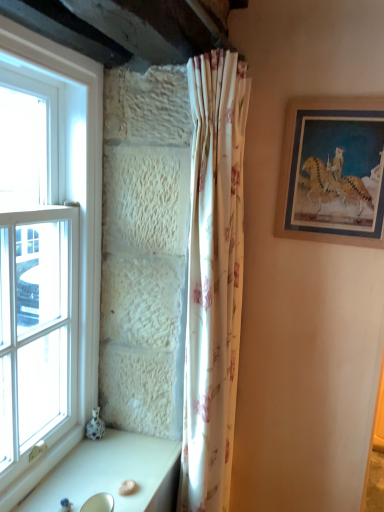
The width and height of the screenshot is (384, 512). What do you see at coordinates (69, 203) in the screenshot?
I see `white glass window at left` at bounding box center [69, 203].

Find the location of a particular element. The height and width of the screenshot is (512, 384). white glossy table at lower left is located at coordinates (112, 474).

Is white floral fabric curtain at center behind white glossy table at lower left?

Yes, it is.

Considering the positions of point (213, 351) and point (180, 447), is point (213, 351) closer or farther from the camera than point (180, 447)?

Point (213, 351) is positioned closer to the camera compared to point (180, 447).

Would you say white floral fabric curtain at center is outside white glossy table at lower left?

Yes.

Can you tell me how much white floral fabric curtain at center and white glossy table at lower left differ in facing direction?

0.000691 degrees.

Can you confirm if white glossy table at lower left is taller than white glossy sink at lower left?

No.

Identify the location of table located on the left of white glossy sink at lower left. This screenshot has width=384, height=512. (112, 474).

Is the position of white glossy table at lower left less distant than that of white glossy sink at lower left?

No, white glossy table at lower left is further to the viewer.

Does white glossy table at lower left have a smaller size compared to white glossy sink at lower left?

No.

Is white glass window at left aimed at wooden picture frame at upper right?

No.

This screenshot has width=384, height=512. I want to click on window below the wooden picture frame at upper right (from the image's perspective), so click(69, 203).

Based on the photo, is white glass window at left inside or outside of wooden picture frame at upper right?

white glass window at left is not enclosed by wooden picture frame at upper right.

Can you confirm if white glossy table at lower left is shorter than white floral fabric curtain at center?

Yes.

The width and height of the screenshot is (384, 512). Find the location of `curtain above the white glossy table at lower left (from the image's perspective)`. curtain above the white glossy table at lower left (from the image's perspective) is located at coordinates (213, 278).

Can you confirm if white glossy table at lower left is positioned to the right of white floral fabric curtain at center?

In fact, white glossy table at lower left is to the left of white floral fabric curtain at center.

Is white floral fabric curtain at center spatially inside white glossy sink at lower left, or outside of it?

The correct answer is: outside.

Is white floral fabric curtain at center facing towards white glossy sink at lower left?

No, white floral fabric curtain at center is not turned towards white glossy sink at lower left.

Between white floral fabric curtain at center and white glossy sink at lower left, which one has less height?

With less height is white glossy sink at lower left.

Which object is wider, white floral fabric curtain at center or white glossy sink at lower left?

Wider between the two is white floral fabric curtain at center.

Considering the positions of objects white glass window at left and white floral fabric curtain at center in the image provided, who is in front, white glass window at left or white floral fabric curtain at center?

Positioned in front is white glass window at left.

From the image's perspective, is white glass window at left below white floral fabric curtain at center?

No, from the image's perspective, white glass window at left is not below white floral fabric curtain at center.

Can you confirm if white glass window at left is positioned to the right of white floral fabric curtain at center?

No, white glass window at left is not to the right of white floral fabric curtain at center.

Locate an element on the screen. window above the white floral fabric curtain at center (from a real-world perspective) is located at coordinates (69, 203).

Considering the positions of objects wooden picture frame at upper right and white glossy table at lower left in the image provided, who is more to the left, wooden picture frame at upper right or white glossy table at lower left?

white glossy table at lower left.

Does point (311, 168) come in front of point (139, 484)?

No.

Is wooden picture frame at upper right turned away from white glossy table at lower left?

wooden picture frame at upper right does not have its back to white glossy table at lower left.

From a real-world perspective, is wooden picture frame at upper right located beneath white glossy table at lower left?

No, from a real-world perspective, wooden picture frame at upper right is not below white glossy table at lower left.

Where is `curtain on the right of white glossy table at lower left`? curtain on the right of white glossy table at lower left is located at coordinates (213, 278).

Find the location of a particular element. This screenshot has width=384, height=512. table on the left of the white glossy sink at lower left is located at coordinates 112,474.

Based on their spatial positions, is white glossy table at lower left or white floral fabric curtain at center further from white glossy sink at lower left?

white floral fabric curtain at center.

In the scene shown: Which object lies further to the anchor point white glossy table at lower left, white glass window at left or white floral fabric curtain at center?

white floral fabric curtain at center lies further to white glossy table at lower left than the other object.

Looking at the image, which one is located closer to white glossy sink at lower left, wooden picture frame at upper right or white glass window at left?

white glass window at left is positioned closer to the anchor white glossy sink at lower left.

Consider the image. Considering their positions, is white glossy sink at lower left positioned closer to white glass window at left than wooden picture frame at upper right?

white glossy sink at lower left is closer to white glass window at left.

Looking at the image, which one is located further to white glossy table at lower left, white glass window at left or white glossy sink at lower left?

white glass window at left.

Considering their positions, is white floral fabric curtain at center positioned closer to white glossy sink at lower left than white glossy table at lower left?

white glossy table at lower left is closer to white glossy sink at lower left.

When comparing their distances from white glossy table at lower left, does white glossy sink at lower left or white floral fabric curtain at center seem further?

white floral fabric curtain at center is positioned further to the anchor white glossy table at lower left.

From the image, which object appears to be farther from white floral fabric curtain at center, white glossy sink at lower left or wooden picture frame at upper right?

white glossy sink at lower left lies further to white floral fabric curtain at center than the other object.

Where is `curtain between wooden picture frame at upper right and white glossy table at lower left in the vertical direction`? Image resolution: width=384 pixels, height=512 pixels. curtain between wooden picture frame at upper right and white glossy table at lower left in the vertical direction is located at coordinates (213, 278).

Find the location of a particular element. Image resolution: width=384 pixels, height=512 pixels. curtain between wooden picture frame at upper right and white glossy sink at lower left in the up-down direction is located at coordinates (213, 278).

Find the location of a particular element. The width and height of the screenshot is (384, 512). curtain located between white glass window at left and wooden picture frame at upper right in the left-right direction is located at coordinates (213, 278).

Locate an element on the screen. This screenshot has height=512, width=384. curtain between white glass window at left and white glossy table at lower left in the up-down direction is located at coordinates (213, 278).